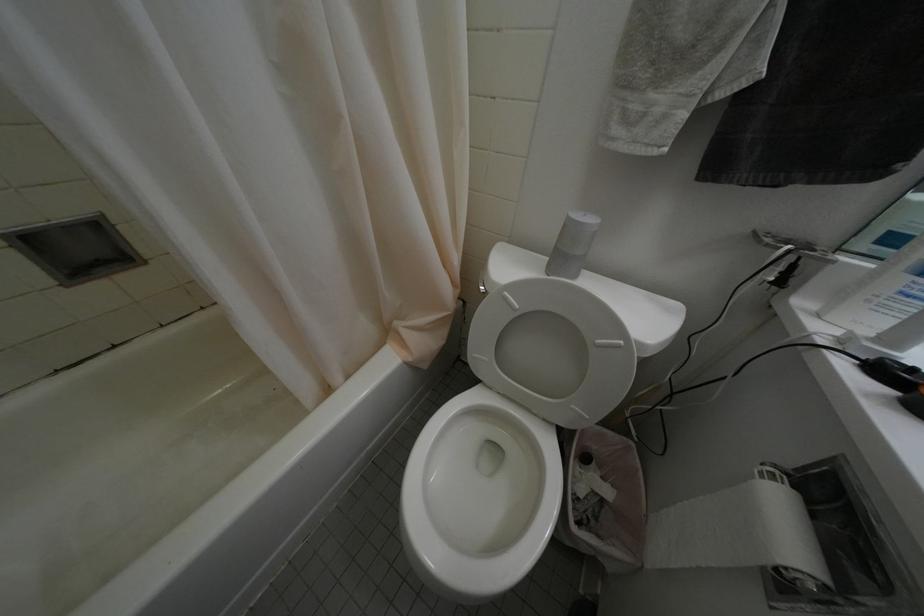
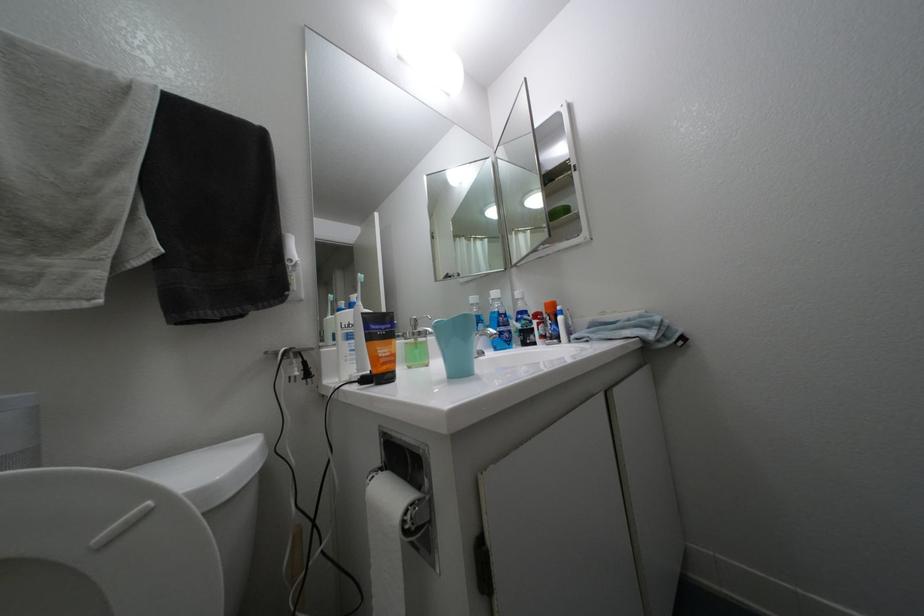
Question: The first image is from the beginning of the video and the second image is from the end. How did the camera likely rotate when shooting the video?

Choices:
 (A) Left
 (B) Right
 (C) Up
 (D) Down

Answer: (B)